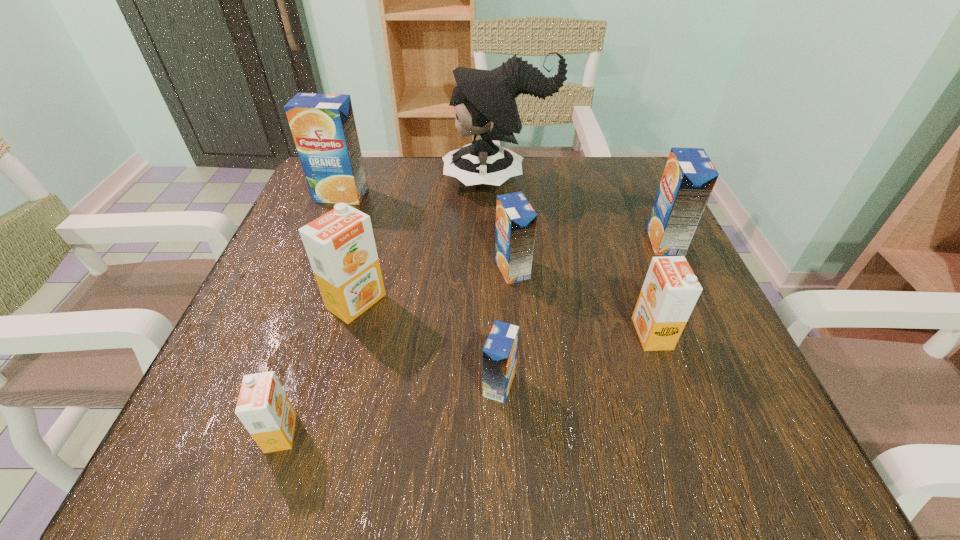
This screenshot has height=540, width=960. Identify the location of vacant space at the left edge of the desktop. (304, 306).

Where is `vacant space at the right edge of the desktop`? vacant space at the right edge of the desktop is located at coordinates (597, 218).

In order to click on blank space at the far right corner of the desktop in this screenshot , I will do [582, 170].

Locate an element on the screen. blank region between the second orange juice from right to left and the second smallest blue orange_juice is located at coordinates (582, 301).

Where is `vacant area that lies between the nearest object and the biggest orange orange juice`? Image resolution: width=960 pixels, height=540 pixels. vacant area that lies between the nearest object and the biggest orange orange juice is located at coordinates (319, 367).

Find the location of a particular element. The width and height of the screenshot is (960, 540). free space between the biggest orange orange juice and the rightmost orange orange juice is located at coordinates (504, 318).

Locate an element on the screen. vacant space that is in between the second biggest orange orange juice and the biggest orange orange juice is located at coordinates (504, 318).

Where is `vacant point located between the second smallest blue orange_juice and the biggest orange orange juice`? This screenshot has width=960, height=540. vacant point located between the second smallest blue orange_juice and the biggest orange orange juice is located at coordinates (434, 285).

Locate an element on the screen. This screenshot has height=540, width=960. empty space that is in between the rightmost object and the third biggest blue orange_juice is located at coordinates (588, 255).

The image size is (960, 540). I want to click on vacant point located between the biggest orange orange juice and the doll, so click(427, 241).